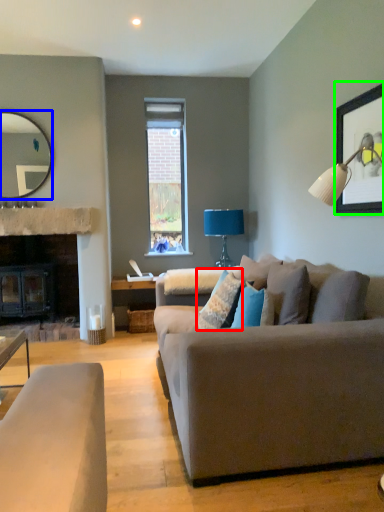
Question: Which object is positioned farthest from pillow (highlighted by a red box)? Select from mirror (highlighted by a blue box) and picture frame (highlighted by a green box).

Choices:
 (A) mirror
 (B) picture frame

Answer: (A)